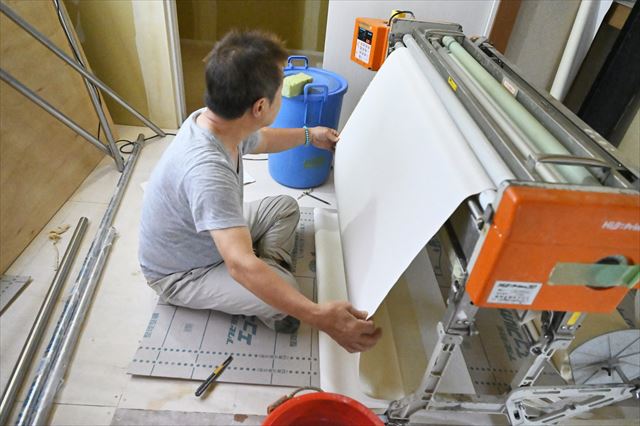
The image size is (640, 426). What are the coordinates of `floor tile` in the screenshot? It's located at (97, 307).